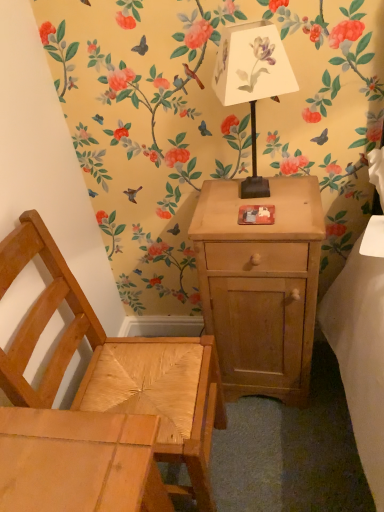
This screenshot has height=512, width=384. What do you see at coordinates (116, 365) in the screenshot?
I see `natural wood chair at lower left` at bounding box center [116, 365].

What do you see at coordinates (260, 285) in the screenshot? I see `light brown wood nightstand at center` at bounding box center [260, 285].

This screenshot has width=384, height=512. Identify the location of white paper lampshade at upper center. (252, 80).

Where is `natural wood chair at lower left`? The width and height of the screenshot is (384, 512). natural wood chair at lower left is located at coordinates (116, 365).

How many degrees apart are the facing directions of natural wood chair at lower left and light brown wood nightstand at center?

The angle between the facing direction of natural wood chair at lower left and the facing direction of light brown wood nightstand at center is 89.6 degrees.

Image resolution: width=384 pixels, height=512 pixels. Identify the location of nightstand that is behind the natural wood chair at lower left. (260, 285).

Is natural wood chair at lower left smaller than light brown wood nightstand at center?

Actually, natural wood chair at lower left might be larger than light brown wood nightstand at center.

Which is behind, point (139, 343) or point (306, 309)?

Point (139, 343)

Looking at this image, does light brown wood nightstand at center lie behind natural wood chair at lower left?

Yes, the depth of light brown wood nightstand at center is greater than that of natural wood chair at lower left.

Considering the relative sizes of light brown wood nightstand at center and natural wood chair at lower left in the image provided, is light brown wood nightstand at center smaller than natural wood chair at lower left?

Indeed, light brown wood nightstand at center has a smaller size compared to natural wood chair at lower left.

In the scene shown: Is light brown wood nightstand at center facing towards natural wood chair at lower left?

No.

Is white paper lampshade at upper center touching natural wood chair at lower left?

No, white paper lampshade at upper center is not beside natural wood chair at lower left.

Is white paper lampshade at upper center inside the boundaries of natural wood chair at lower left, or outside?

white paper lampshade at upper center is spatially situated outside natural wood chair at lower left.

Which is behind, point (273, 72) or point (172, 458)?

The point (172, 458) is behind.

Is white paper lampshade at upper center positioned with its back to natural wood chair at lower left?

No.

Which point is more distant from viewer, (181, 433) or (238, 88)?

Positioned behind is point (181, 433).

Between natural wood chair at lower left and white paper lampshade at upper center, which one has smaller size?

Smaller between the two is white paper lampshade at upper center.

Identify the location of table lamp that appears behind the natural wood chair at lower left. Image resolution: width=384 pixels, height=512 pixels. (252, 80).

Is natural wood chair at lower left shorter than white paper lampshade at upper center?

Incorrect, the height of natural wood chair at lower left does not fall short of that of white paper lampshade at upper center.

Based on the photo, which of these two, light brown wood nightstand at center or white paper lampshade at upper center, stands shorter?

With less height is white paper lampshade at upper center.

Relative to white paper lampshade at upper center, is light brown wood nightstand at center in front or behind?

light brown wood nightstand at center is positioned farther from the viewer than white paper lampshade at upper center.

Is light brown wood nightstand at center spatially inside white paper lampshade at upper center, or outside of it?

light brown wood nightstand at center is located beyond the bounds of white paper lampshade at upper center.

Consider the image. Which is more to the left, white paper lampshade at upper center or light brown wood nightstand at center?

white paper lampshade at upper center is more to the left.

Is point (262, 93) positioned in front of point (275, 361)?

Yes, point (262, 93) is closer to viewer.

From the image's perspective, is white paper lampshade at upper center located above or below light brown wood nightstand at center?

Clearly, from the image's perspective, white paper lampshade at upper center is above light brown wood nightstand at center.

Would you say white paper lampshade at upper center contains light brown wood nightstand at center?

No, light brown wood nightstand at center is not inside white paper lampshade at upper center.

Locate an element on the screen. nightstand located on the right of natural wood chair at lower left is located at coordinates (260, 285).

Locate an element on the screen. This screenshot has height=512, width=384. chair on the left of light brown wood nightstand at center is located at coordinates (116, 365).

When comparing their distances from white paper lampshade at upper center, does natural wood chair at lower left or light brown wood nightstand at center seem further?

The object further to white paper lampshade at upper center is natural wood chair at lower left.

Estimate the real-world distances between objects in this image. Which object is further from light brown wood nightstand at center, white paper lampshade at upper center or natural wood chair at lower left?

Based on the image, white paper lampshade at upper center appears to be further to light brown wood nightstand at center.

Looking at the image, which one is located closer to natural wood chair at lower left, white paper lampshade at upper center or light brown wood nightstand at center?

Among the two, light brown wood nightstand at center is located nearer to natural wood chair at lower left.

Looking at the image, which one is located closer to white paper lampshade at upper center, light brown wood nightstand at center or natural wood chair at lower left?

light brown wood nightstand at center lies closer to white paper lampshade at upper center than the other object.

When comparing their distances from light brown wood nightstand at center, does natural wood chair at lower left or white paper lampshade at upper center seem further?

white paper lampshade at upper center is positioned further to the anchor light brown wood nightstand at center.

Considering their positions, is light brown wood nightstand at center positioned further to natural wood chair at lower left than white paper lampshade at upper center?

white paper lampshade at upper center is further to natural wood chair at lower left.

At what (x,y) coordinates should I click in order to perform the action: click on nightstand that lies between white paper lampshade at upper center and natural wood chair at lower left from top to bottom. Please return your answer as a coordinate pair (x, y). The height and width of the screenshot is (512, 384). Looking at the image, I should click on (260, 285).